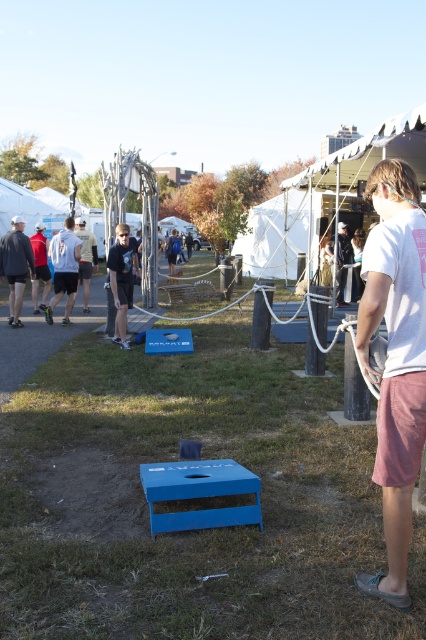
Is the position of dark blue shirt at center less distant than that of light blue t-shirt at center?

That is True.

Does dark blue shirt at center appear on the left side of light blue t-shirt at center?

No, dark blue shirt at center is not to the left of light blue t-shirt at center.

Is point (106, 260) farther from camera compared to point (89, 310)?

No, it is in front of (89, 310).

Where is `dark blue shirt at center`? dark blue shirt at center is located at coordinates (121, 278).

Does white matte shirt at center have a smaller size compared to matte black jacket at center?

Correct, white matte shirt at center occupies less space than matte black jacket at center.

The height and width of the screenshot is (640, 426). What do you see at coordinates (63, 268) in the screenshot?
I see `white matte shirt at center` at bounding box center [63, 268].

Image resolution: width=426 pixels, height=640 pixels. Find the location of `white matte shirt at center`. white matte shirt at center is located at coordinates (63, 268).

Does green grass at center appear on the right side of matte black jacket at center?

Incorrect, green grass at center is not on the right side of matte black jacket at center.

Consider the image. Can you confirm if green grass at center is positioned to the left of matte black jacket at center?

Correct, you'll find green grass at center to the left of matte black jacket at center.

You are a GUI agent. You are given a task and a screenshot of the screen. Output one action in this format:
    pyautogui.click(x=<x>, y=<y>)
    Task: Click on the green grass at center
    The width and height of the screenshot is (426, 640).
    Given the screenshot: What is the action you would take?
    pyautogui.click(x=195, y=531)